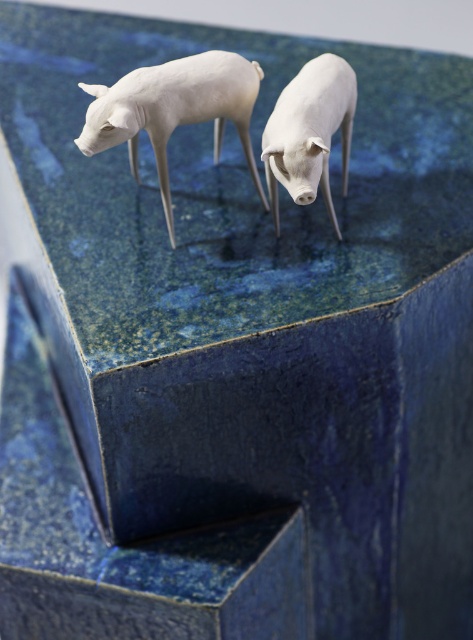
Question: Is white matte lamb at center positioned before white matte pig at center?

Choices:
 (A) no
 (B) yes

Answer: (A)

Question: Among these points, which one is nearest to the camera?

Choices:
 (A) (107, 113)
 (B) (285, 138)

Answer: (B)

Question: In this image, where is white matte lamb at center located relative to white matte pig at center?

Choices:
 (A) above
 (B) below

Answer: (A)

Question: Can you confirm if white matte lamb at center is thinner than white matte pig at center?

Choices:
 (A) yes
 (B) no

Answer: (B)

Question: Which point is farther to the camera?

Choices:
 (A) white matte lamb at center
 (B) white matte pig at center

Answer: (A)

Question: Which of the following is the farthest from the observer?

Choices:
 (A) white matte lamb at center
 (B) white matte pig at center

Answer: (A)